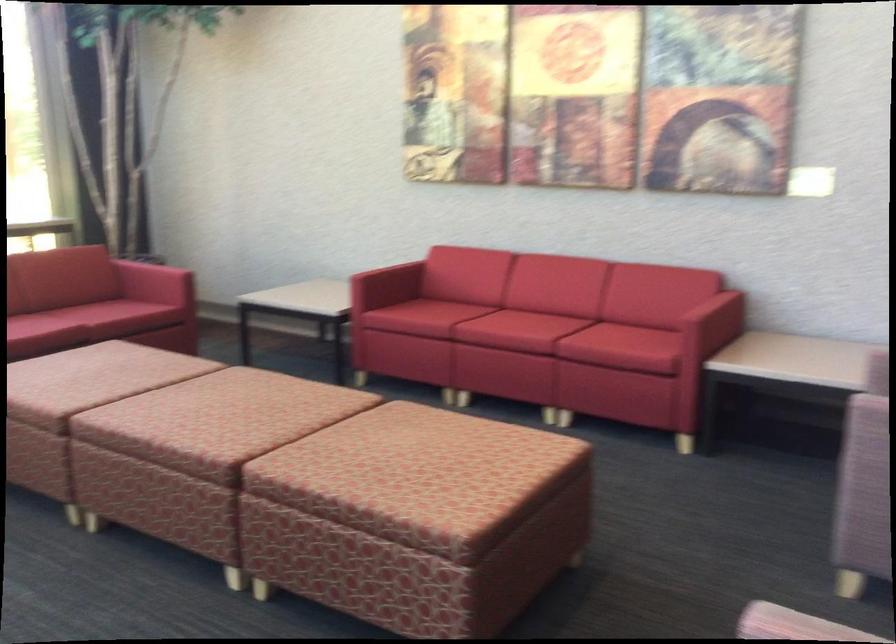
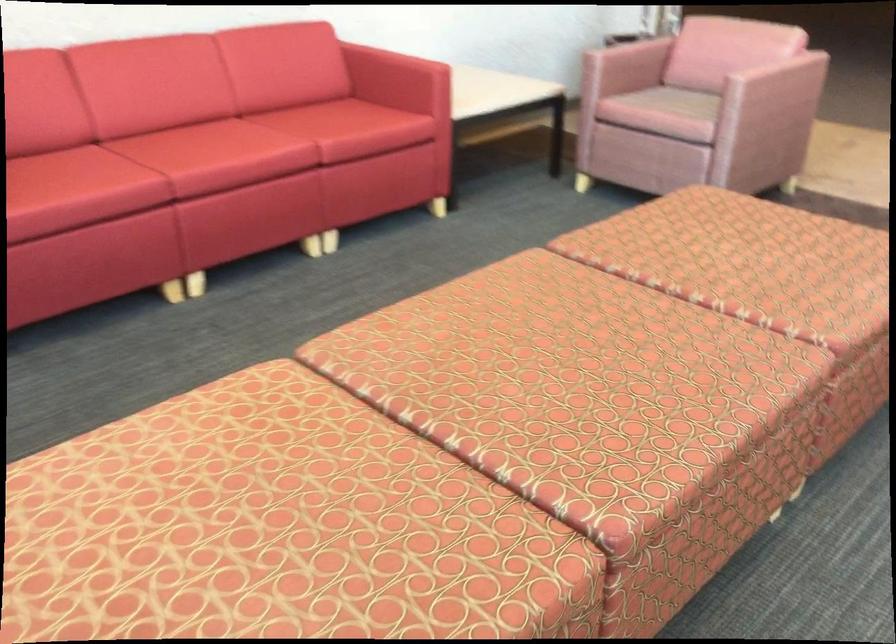
Locate, in the second image, the point that corresponds to point 219,402 in the first image.

(549, 377)